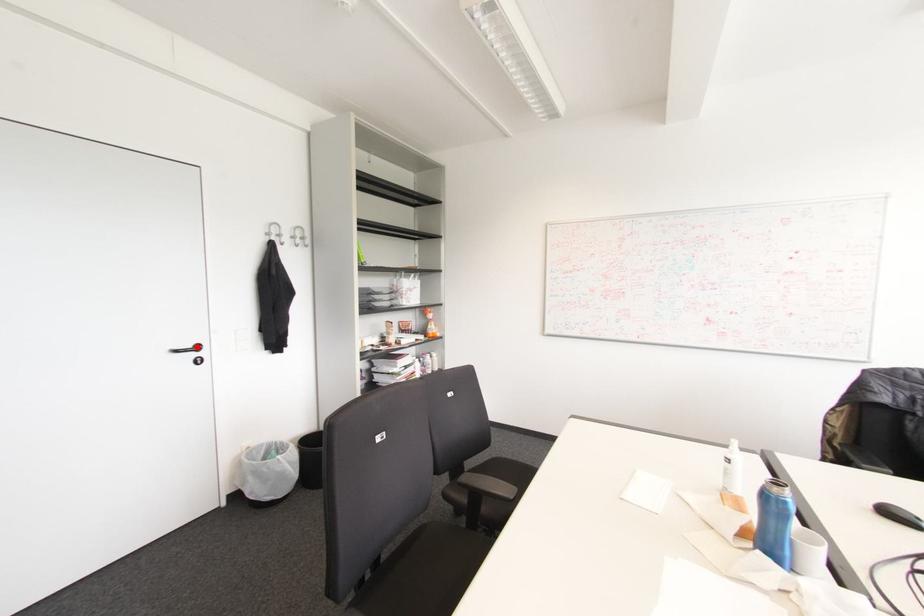
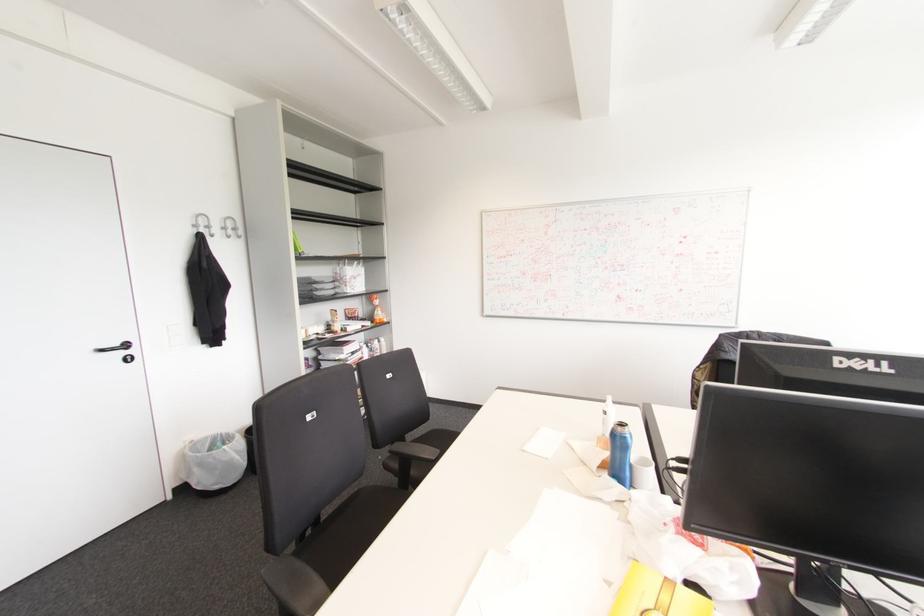
Find the pixel in the second image that matches the highlighted location in the first image.

(126, 345)